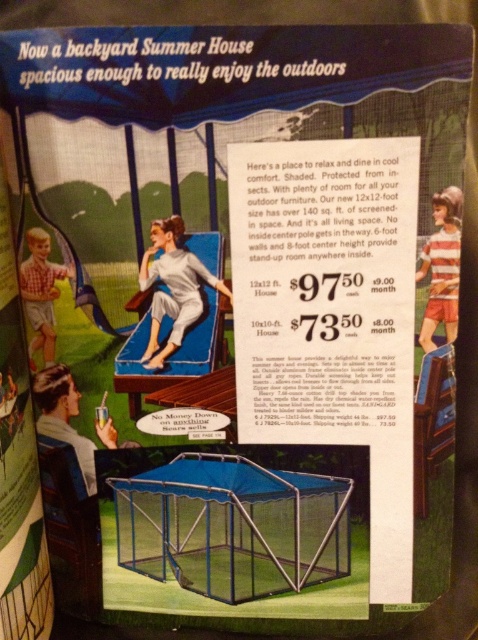
You are planning to set up a small garden party and need to place both the blue mesh cage at center and the matte white lounge chair at center in your backyard. Given their sizes, which one should you prioritize placing first to ensure they both fit comfortably?

The blue mesh cage at center is larger in size than the matte white lounge chair at center, so you should prioritize placing the blue mesh cage at center first to ensure there is enough space for both items.

Based on the provided scene description, what object is located at the coordinates point (x=173, y=288)?

The object at point (x=173, y=288) is the matte white lounge chair at center.

You are a customer looking at this advertisement and want to know if the blue mesh cage at center is placed above or below the striped fabric shirt at upper right. Based on the image, what is the correct spatial relationship between these two items?

The blue mesh cage at center is located below the striped fabric shirt at upper right.